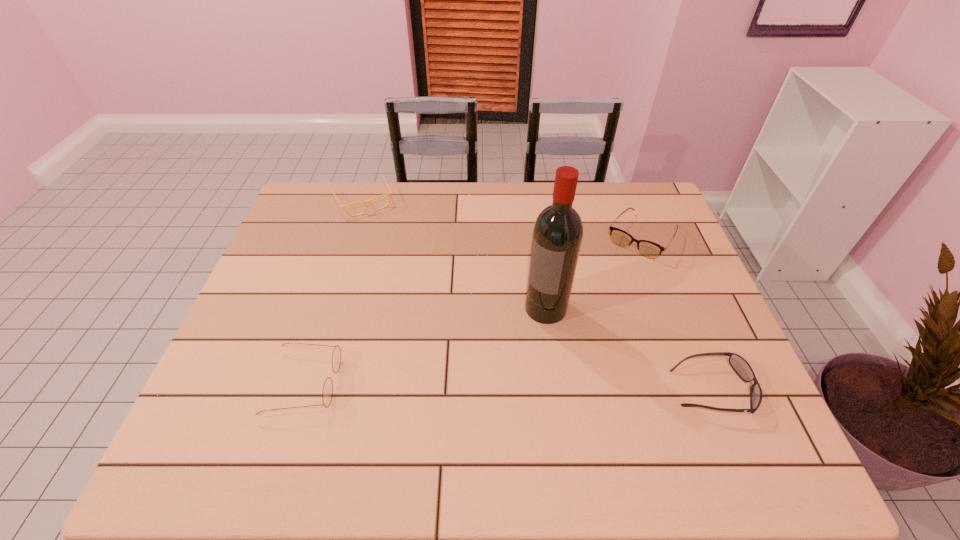
I want to click on free spot located 0.220m on the face of the rightmost spectacles, so click(x=595, y=304).

The width and height of the screenshot is (960, 540). Identify the location of free space located 0.380m on the face of the rightmost spectacles. (567, 344).

Identify the location of spectacles that is at the near edge. (327, 393).

Find the location of a particular element. sunglasses located in the near edge section of the desktop is located at coordinates (742, 368).

This screenshot has width=960, height=540. What are the coordinates of `sunglasses at the right edge` in the screenshot? It's located at (742, 368).

Where is `spectacles situated at the right edge`? This screenshot has height=540, width=960. spectacles situated at the right edge is located at coordinates (648, 249).

Where is `object that is at the far left corner`? The width and height of the screenshot is (960, 540). object that is at the far left corner is located at coordinates (365, 202).

Locate an element on the screen. object at the near left corner is located at coordinates (327, 393).

In order to click on object that is at the far right corner in this screenshot , I will do `click(648, 249)`.

This screenshot has width=960, height=540. I want to click on object that is at the near right corner, so click(742, 368).